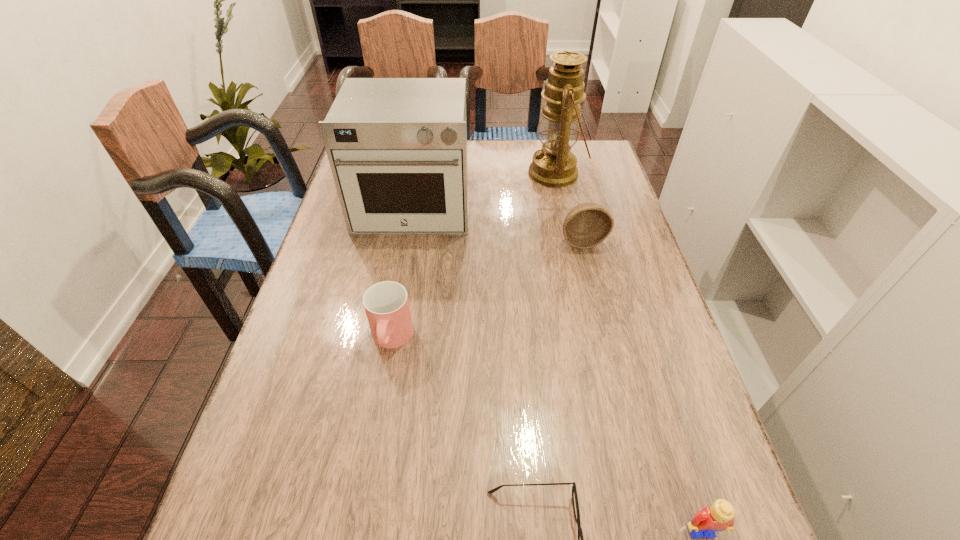
Locate an element on the screen. This screenshot has height=540, width=960. oil lamp located at the right edge is located at coordinates click(554, 165).

At what (x,y) coordinates should I click in order to perform the action: click on bowl that is positioned at the right edge. Please return your answer as a coordinate pair (x, y). This screenshot has height=540, width=960. Looking at the image, I should click on (586, 225).

The image size is (960, 540). In order to click on object located at the far right corner in this screenshot , I will do `click(554, 165)`.

Identify the location of vacant space at the far edge. (503, 141).

The image size is (960, 540). Find the location of `vacant area at the left edge of the desktop`. vacant area at the left edge of the desktop is located at coordinates (x=242, y=459).

This screenshot has width=960, height=540. Find the location of `free space at the right edge`. free space at the right edge is located at coordinates (670, 491).

Identify the location of free space that is in between the bowl and the third nearest object. This screenshot has width=960, height=540. 487,290.

I want to click on unoccupied area between the oil lamp and the bowl, so click(x=569, y=207).

You are a GUI agent. You are given a task and a screenshot of the screen. Output one action in this format:
    pyautogui.click(x=<x>, y=<y>)
    Task: Click on the unoccupied position between the bowl and the oil lamp
    
    Given the screenshot: What is the action you would take?
    pyautogui.click(x=569, y=207)

The image size is (960, 540). Find the location of `free space between the toaster oven and the oil lamp`. free space between the toaster oven and the oil lamp is located at coordinates (485, 190).